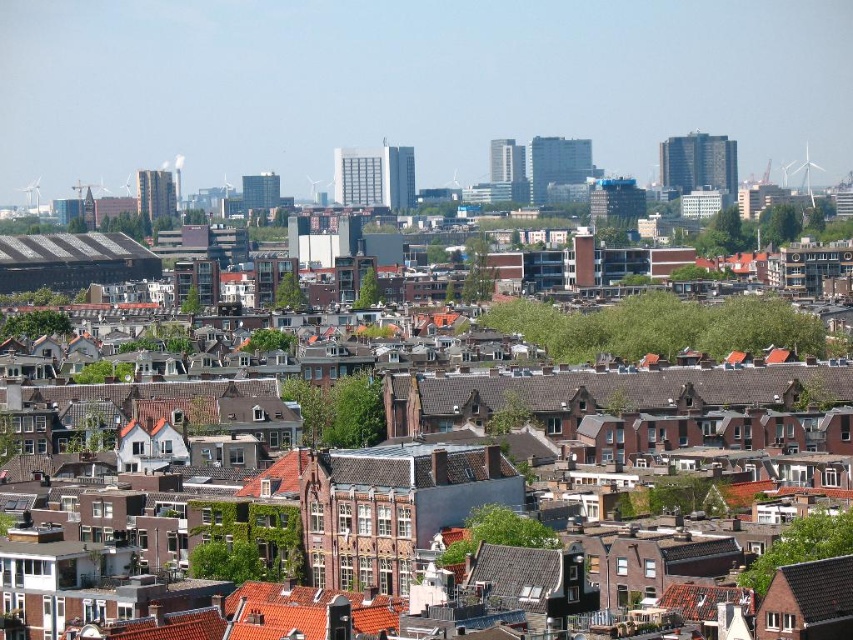
You are standing in the urban area and notice two points in the scene. The first point is located at coordinates point (810, 200) and the second at point (322, 192). Which of these points is closer to you?

Point (810, 200) is closer to the viewer than point (322, 192).